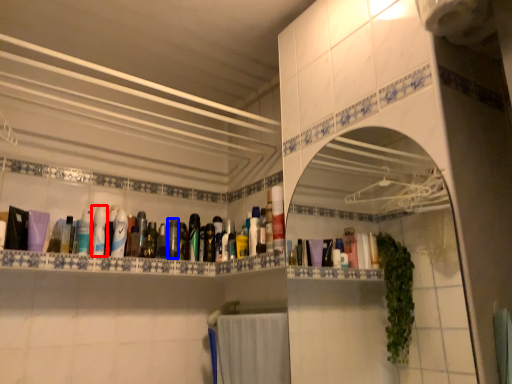
Question: Which of the following is the farthest to the observer, mouthwash (highlighted by a red box) or mouthwash (highlighted by a blue box)?

Choices:
 (A) mouthwash
 (B) mouthwash

Answer: (B)